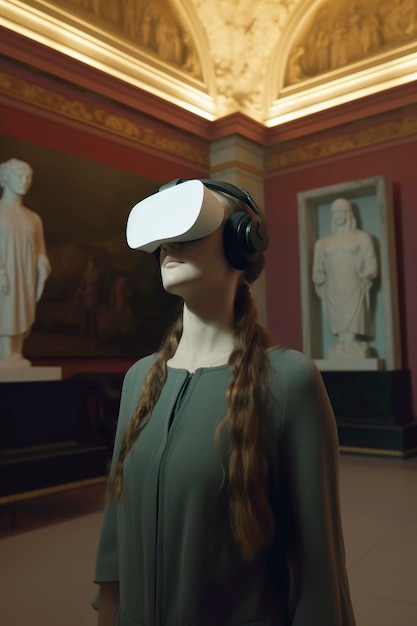
This screenshot has width=417, height=626. In order to click on floor in this screenshot , I will do `click(381, 590)`.